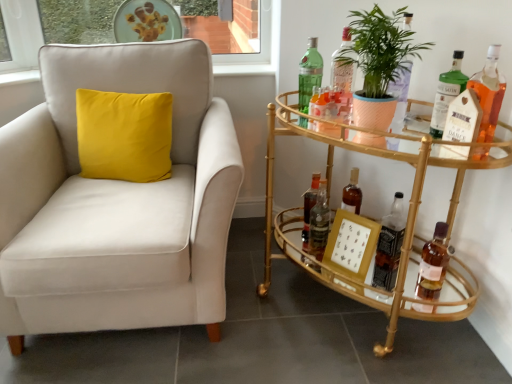
Question: From the image's perspective, is translucent amber glass bottle at lower right, positioned as the second bottle in right-to-left order, located above or below translucent glass bottle at center, the fifth bottle when ordered from left to right?

Choices:
 (A) above
 (B) below

Answer: (B)

Question: Is translucent amber glass bottle at lower right, positioned as the second bottle in right-to-left order, wider or thinner than translucent glass bottle at center, which is the 4th bottle from right to left?

Choices:
 (A) thin
 (B) wide

Answer: (A)

Question: Considering the real-world distances, which object is closest to the green matte plant at right?

Choices:
 (A) translucent glass bottle at right, placed as the 1th bottle when sorted from right to left
 (B) green glass bottle at upper center, acting as the 8th bottle starting from the right
 (C) translucent amber glass bottle at lower right, positioned as the second bottle in right-to-left order
 (D) green glass bottle at right, the 6th bottle from the left
 (E) suede beige armchair at left

Answer: (D)

Question: Considering the real-world distances, which object is closest to the green matte plant at right?

Choices:
 (A) translucent amber glass bottle at lower right, positioned as the second bottle in right-to-left order
 (B) translucent glass bottle at center, acting as the second bottle starting from the left
 (C) suede beige armchair at left
 (D) translucent glass bottle at right, placed as the 1th bottle when sorted from right to left
 (E) gold glass bar cart at right

Answer: (D)